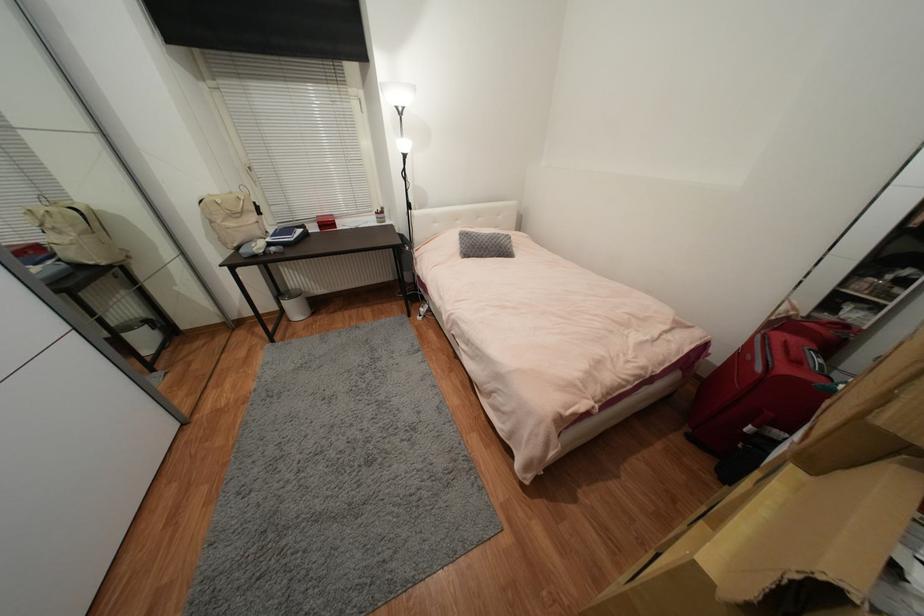
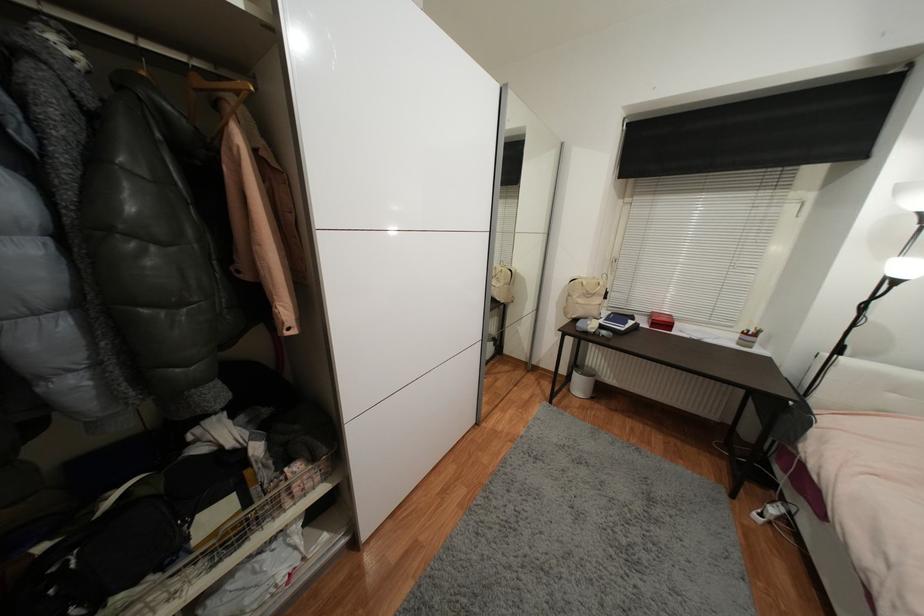
Question: The images are taken continuously from a first-person perspective. In which direction is your viewpoint rotating?

Choices:
 (A) Left
 (B) Right
 (C) Up
 (D) Down

Answer: (A)